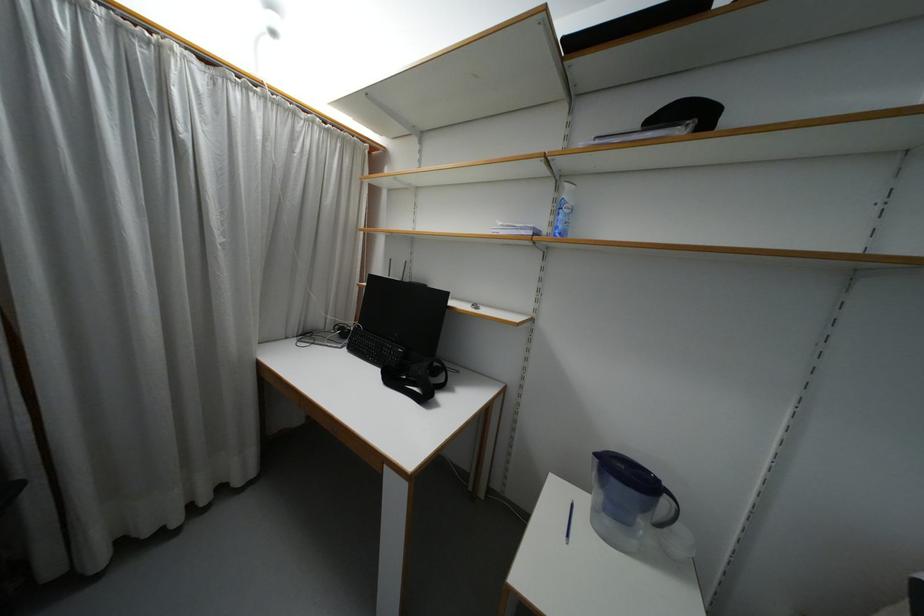
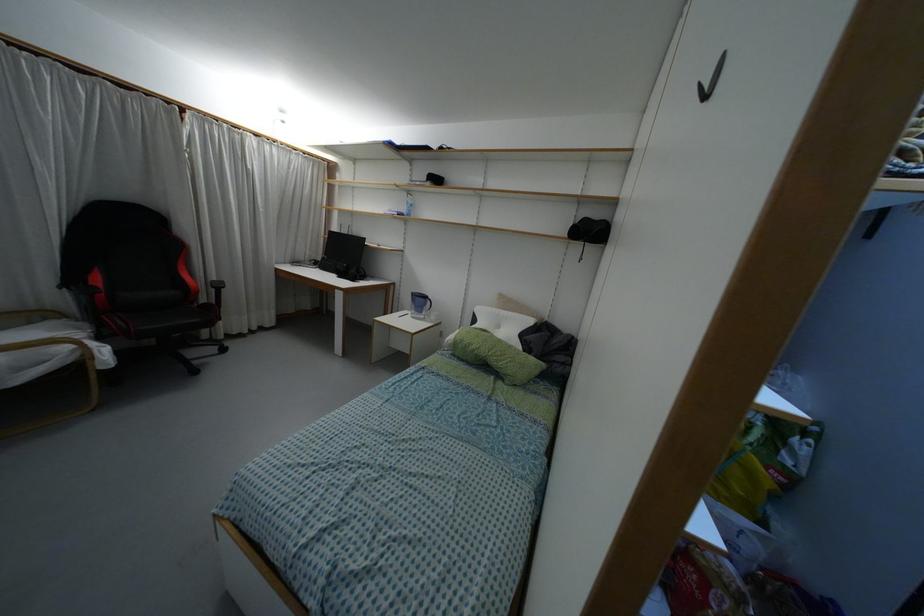
The point at (663, 501) is marked in the first image. Where is the corresponding point in the second image?

(428, 302)